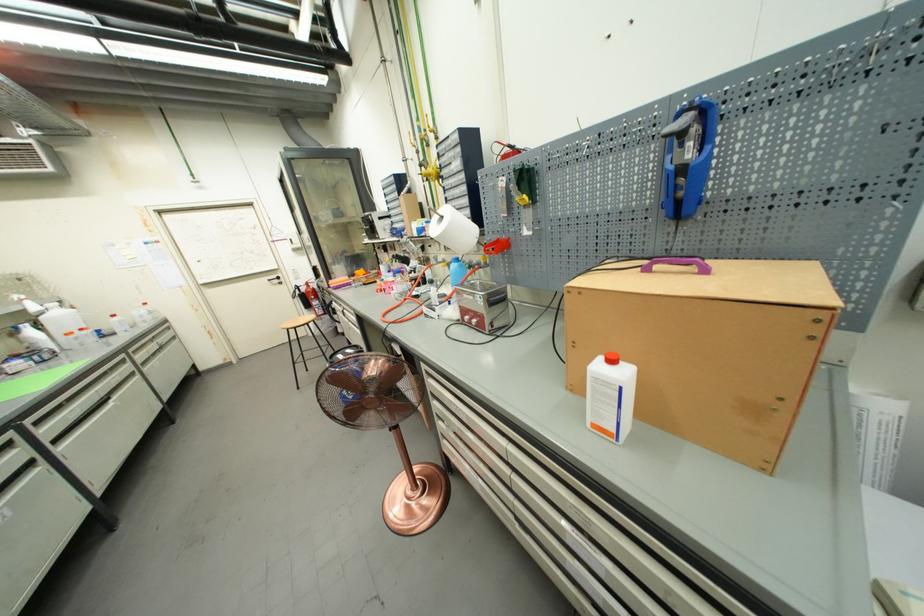
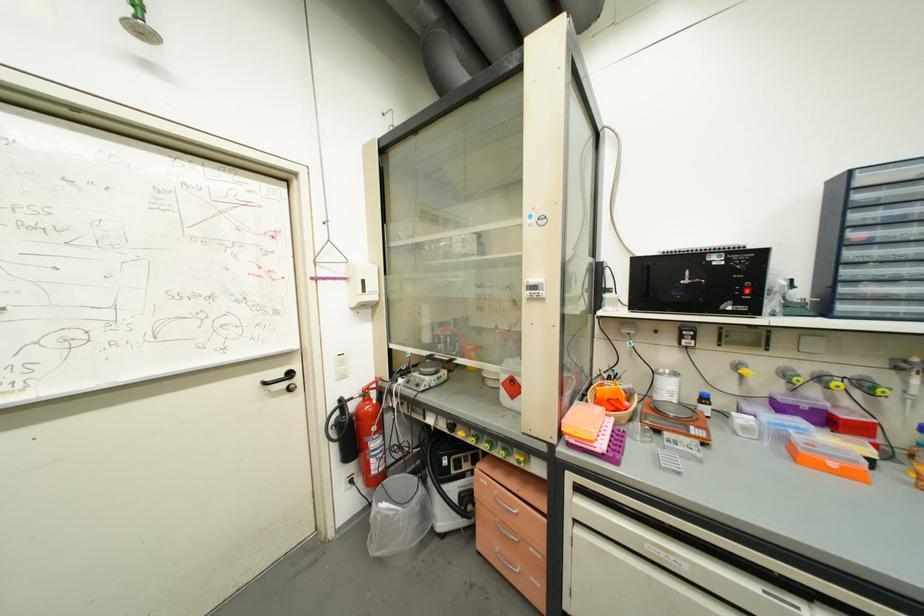
In the second image, find the point that corresponds to (282,283) in the first image.

(289, 387)